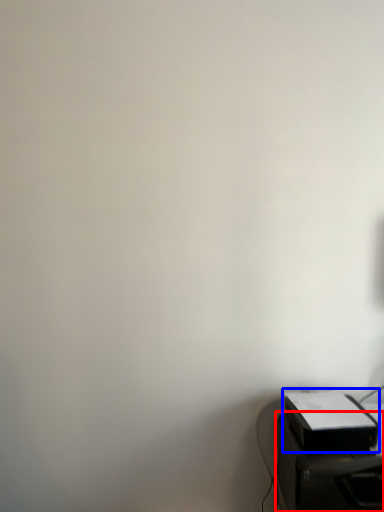
Question: Among these objects, which one is nearest to the camera, furniture (highlighted by a red box) or printer (highlighted by a blue box)?

Choices:
 (A) furniture
 (B) printer

Answer: (A)